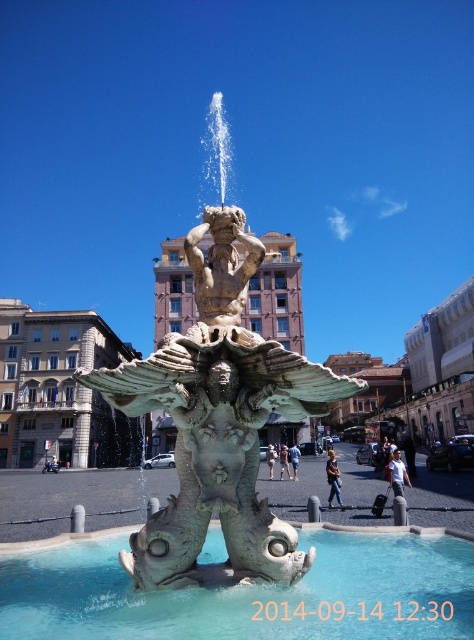
Question: Which object appears closest to the camera in this image?

Choices:
 (A) bronze statue at center
 (B) clear glass water at center
 (C) white marble statue at center

Answer: (B)

Question: Which of the following is the closest to the observer?

Choices:
 (A) bronze statue at center
 (B) clear glass water at center
 (C) white marble statue at center

Answer: (B)

Question: Does bronze statue at center have a greater width compared to clear glass water at center?

Choices:
 (A) no
 (B) yes

Answer: (B)

Question: Considering the real-world distances, which object is closest to the bronze statue at center?

Choices:
 (A) clear glass water at center
 (B) white marble statue at center

Answer: (A)

Question: Considering the relative positions of bronze statue at center and clear glass water at center in the image provided, where is bronze statue at center located with respect to clear glass water at center?

Choices:
 (A) left
 (B) right

Answer: (A)

Question: Does bronze statue at center appear under clear glass water at center?

Choices:
 (A) yes
 (B) no

Answer: (B)